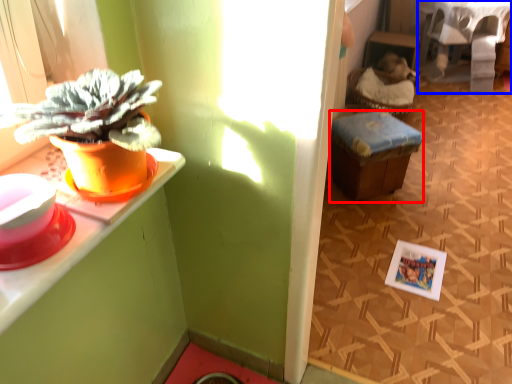
Question: Which of the following is the farthest to the observer, stool (highlighted by a red box) or table (highlighted by a blue box)?

Choices:
 (A) stool
 (B) table

Answer: (B)